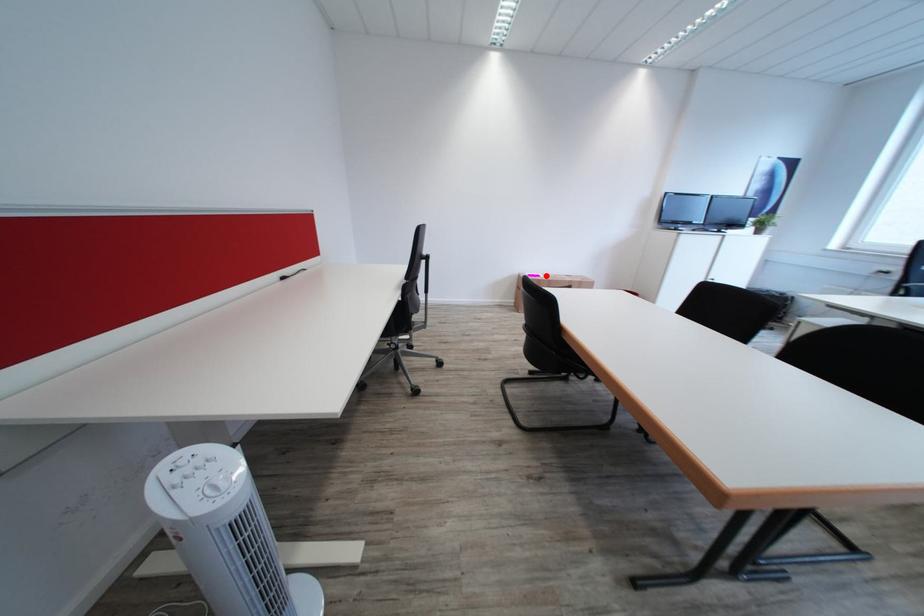
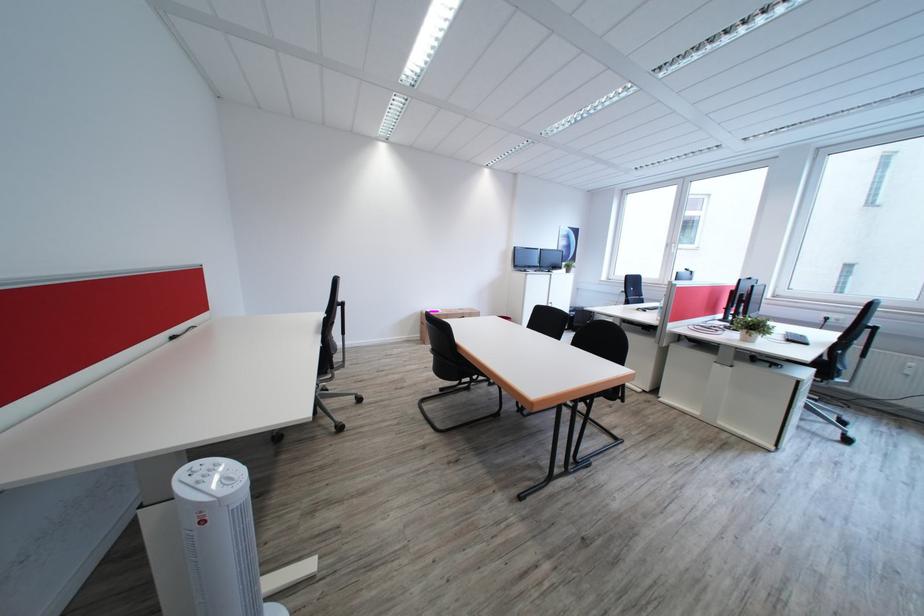
In the second image, find the point that corresponds to the highlighted location in the first image.

(445, 312)